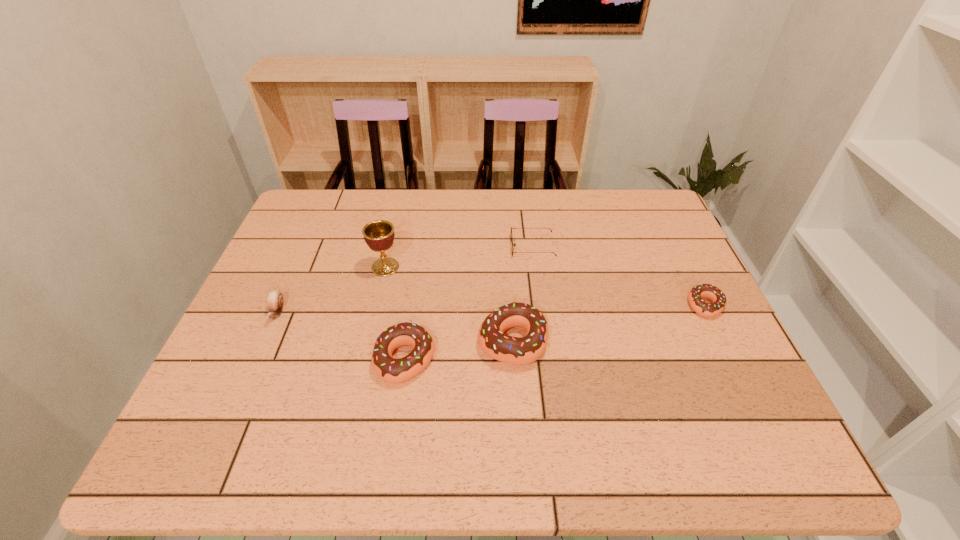
At what (x,y) coordinates should I click in order to perform the action: click on free space located on the front of the shortest doughnut. Please return your answer as a coordinate pair (x, y). The width and height of the screenshot is (960, 540). Looking at the image, I should click on (722, 339).

The height and width of the screenshot is (540, 960). I want to click on vacant space situated on the front-facing side of the sunglasses, so click(x=399, y=247).

Locate an element on the screen. This screenshot has width=960, height=540. free space located 0.280m on the front-facing side of the sunglasses is located at coordinates (417, 247).

Where is `free location located on the front-facing side of the sunglasses`? Image resolution: width=960 pixels, height=540 pixels. free location located on the front-facing side of the sunglasses is located at coordinates (470, 247).

This screenshot has width=960, height=540. I want to click on vacant space situated 0.200m on the right of the tallest object, so click(471, 267).

Where is `free spot located on the front-facing side of the escargot`? This screenshot has height=540, width=960. free spot located on the front-facing side of the escargot is located at coordinates (259, 353).

You are a GUI agent. You are given a task and a screenshot of the screen. Output one action in this format:
    pyautogui.click(x=<x>, y=<y>)
    Task: Click on the object positioned at the near edge
    
    Given the screenshot: What is the action you would take?
    pyautogui.click(x=391, y=370)

The height and width of the screenshot is (540, 960). In order to click on object located in the left edge section of the desktop in this screenshot , I will do `click(275, 299)`.

Identify the location of object present at the right edge. This screenshot has height=540, width=960. (711, 292).

Where is `vacant space at the far edge of the desktop`? This screenshot has width=960, height=540. vacant space at the far edge of the desktop is located at coordinates (377, 201).